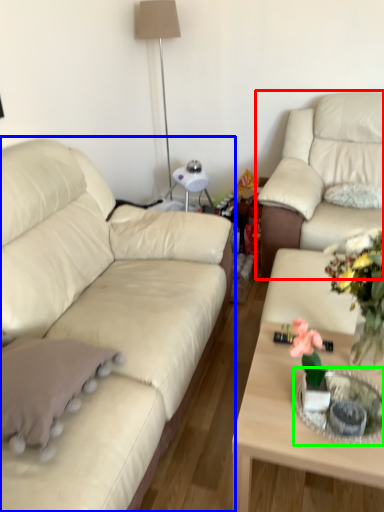
Question: Which is nearer to the studio couch (highlighted by a red box)? studio couch (highlighted by a blue box) or glass table (highlighted by a green box).

Choices:
 (A) studio couch
 (B) glass table

Answer: (A)